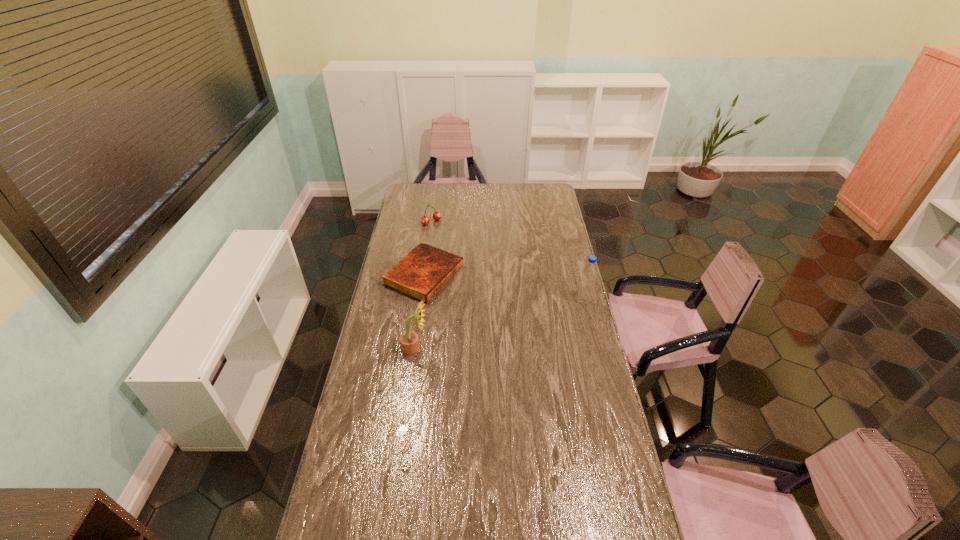
This screenshot has height=540, width=960. I want to click on sunflower, so click(409, 342).

The image size is (960, 540). I want to click on the rightmost object, so click(589, 272).

The width and height of the screenshot is (960, 540). Identify the location of Bible. (421, 274).

Identify the location of the farthest object. (425, 220).

At what (x,y) coordinates should I click in order to perform the action: click on the third tallest object. Please return your answer as a coordinate pair (x, y). This screenshot has height=540, width=960. Looking at the image, I should click on (425, 220).

You are a GUI agent. You are given a task and a screenshot of the screen. Output one action in this format:
    pyautogui.click(x=<x>, y=<y>)
    Task: Click on the vacant space located 0.130m on the face of the nearest object
    The width and height of the screenshot is (960, 540).
    Given the screenshot: What is the action you would take?
    pyautogui.click(x=460, y=349)

I want to click on vacant space located on the left of the rightmost object, so click(x=507, y=301).

Locate an element on the screen. This screenshot has width=960, height=540. free space located 0.140m on the spine side of the Bible is located at coordinates (483, 300).

The image size is (960, 540). In order to click on free spot located 0.170m on the spine side of the Bible in this screenshot , I will do `click(489, 302)`.

The height and width of the screenshot is (540, 960). I want to click on blank space located on the spine side of the Bible, so click(491, 303).